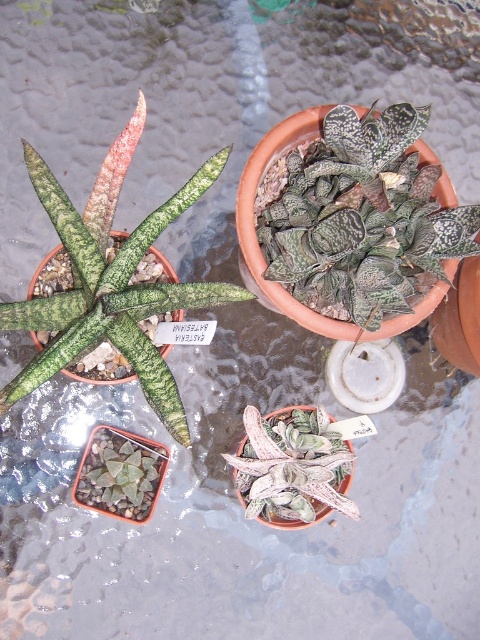
Question: Can you confirm if green textured leaves at left is positioned above white textured leaf at center?

Choices:
 (A) no
 (B) yes

Answer: (B)

Question: Which point is farther to the camera?

Choices:
 (A) (283, 477)
 (B) (384, 262)
 (C) (145, 490)
 (D) (190, 444)

Answer: (C)

Question: Does white textured leaf at center have a larger size compared to green textured succulent at lower left?

Choices:
 (A) yes
 (B) no

Answer: (A)

Question: Among these objects, which one is nearest to the camera?

Choices:
 (A) green textured succulent at lower left
 (B) textured terracotta pot at upper center
 (C) white textured leaf at center

Answer: (B)

Question: Among these objects, which one is nearest to the camera?

Choices:
 (A) white textured leaf at center
 (B) green textured succulent at lower left
 (C) green textured leaves at left
 (D) textured terracotta pot at upper center

Answer: (D)

Question: Considering the relative positions of green textured leaves at left and white textured leaf at center in the image provided, where is green textured leaves at left located with respect to white textured leaf at center?

Choices:
 (A) right
 (B) left

Answer: (B)